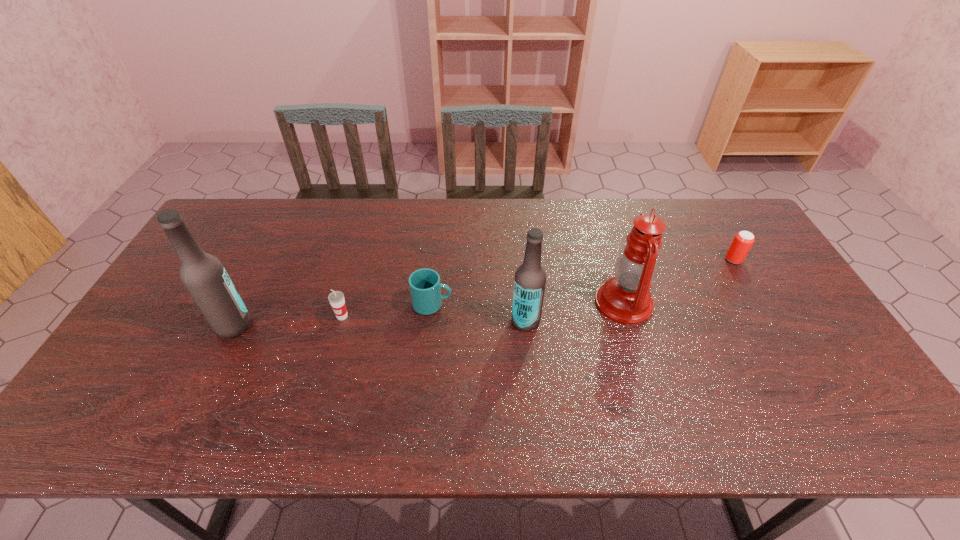
This screenshot has height=540, width=960. In order to click on the closest object to the right beer bottle in this screenshot , I will do `click(625, 298)`.

Select which object appears as the third closest to the rightmost object. Please provide its 2D coordinates. Your answer should be formatted as a tuple, i.e. [(x, y)], where the tuple contains the x and y coordinates of a point satisfying the conditions above.

[(425, 288)]

Locate an element on the screen. free space that satisfies the following two spatial constraints: 1. on the front side of the fifth object from left to right; 2. on the label of the taller beer bottle is located at coordinates (631, 325).

I want to click on free space that satisfies the following two spatial constraints: 1. on the front side of the farthest object; 2. on the handle side of the fourth object from right to left, so [760, 305].

At what (x,y) coordinates should I click in order to perform the action: click on free space that satisfies the following two spatial constraints: 1. on the front side of the second object from right to left; 2. on the label of the taller beer bottle. Please return your answer as a coordinate pair (x, y). Looking at the image, I should click on (631, 325).

I want to click on vacant point that satisfies the following two spatial constraints: 1. on the front side of the rightmost object; 2. on the handle side of the right cup, so click(x=760, y=305).